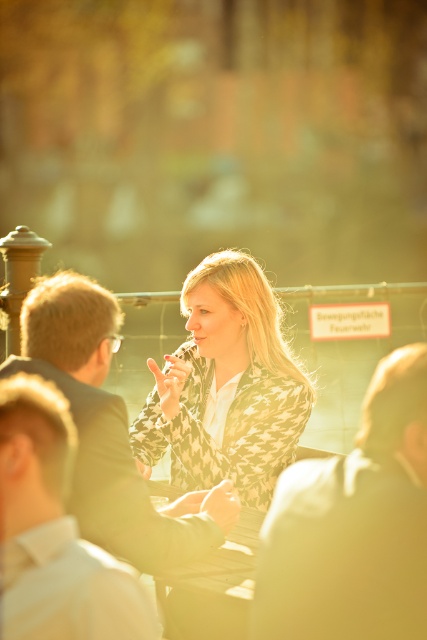
You are standing at the center of the scene. Where is the patterned fabric jacket at center located relative to your position?

The patterned fabric jacket at center is located at point 0.605 on the x axis and 0.529 on the y axis relative to your position at the center of the scene.